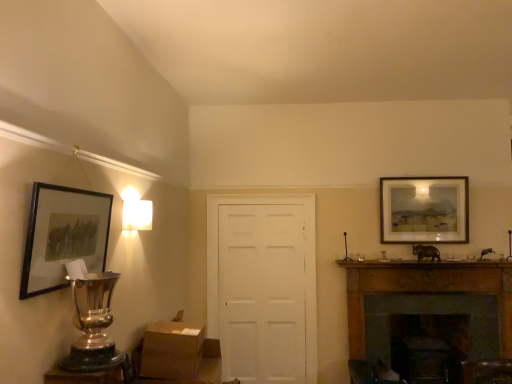
Question: From a real-world perspective, relative to metallic trophy at lower left, is brown cardboard box at lower center vertically above or below?

Choices:
 (A) below
 (B) above

Answer: (A)

Question: Is brown cardboard box at lower center wider or thinner than metallic trophy at lower left?

Choices:
 (A) wide
 (B) thin

Answer: (A)

Question: Estimate the real-world distances between objects in this image. Which object is farther from the brown wood fireplace at right?

Choices:
 (A) metallic trophy at lower left
 (B) matte black picture frame at left, the first picture frame from the left
 (C) matte wooden picture frame at upper right, acting as the 1th picture frame starting from the right
 (D) white matte door at center
 (E) brown cardboard box at lower center

Answer: (B)

Question: Estimate the real-world distances between objects in this image. Which object is farther from the matte wooden picture frame at upper right, which is the first picture frame in back-to-front order?

Choices:
 (A) matte black picture frame at left, arranged as the 1th picture frame when viewed from the front
 (B) brown cardboard box at lower center
 (C) white matte door at center
 (D) brown wood fireplace at right
 (E) metallic trophy at lower left

Answer: (E)